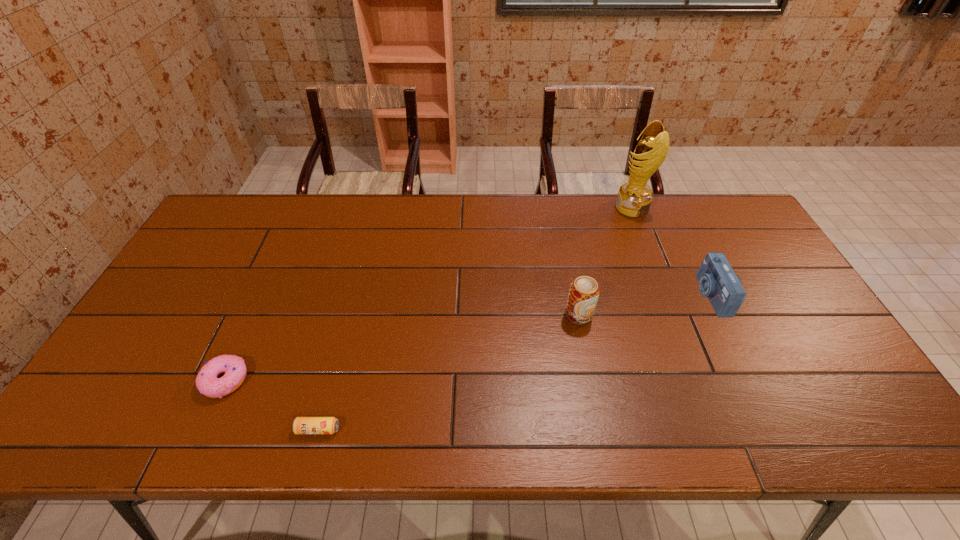
Where is `award`? award is located at coordinates (634, 198).

At what (x,y) coordinates should I click in order to perform the action: click on the tallest object. Please return your answer as a coordinate pair (x, y). Image resolution: width=960 pixels, height=540 pixels. Looking at the image, I should click on (634, 198).

Find the location of a particular element. The height and width of the screenshot is (540, 960). the farther beer can is located at coordinates (583, 295).

You are a GUI agent. You are given a task and a screenshot of the screen. Output one action in this format:
    pyautogui.click(x=<x>, y=<y>)
    Task: Click on the second tallest object
    The width and height of the screenshot is (960, 540).
    Given the screenshot: What is the action you would take?
    pyautogui.click(x=583, y=295)

Find the location of `the third shortest object`. the third shortest object is located at coordinates (717, 280).

In order to click on the rightmost object in this screenshot , I will do `click(717, 280)`.

Find the location of `the leftmost object`. the leftmost object is located at coordinates (207, 382).

This screenshot has height=540, width=960. I want to click on the fourth tallest object, so click(x=207, y=382).

Identify the location of the nearest object. (302, 425).

This screenshot has height=540, width=960. What are the coordinates of `the shorter beer can` in the screenshot? It's located at (302, 425).